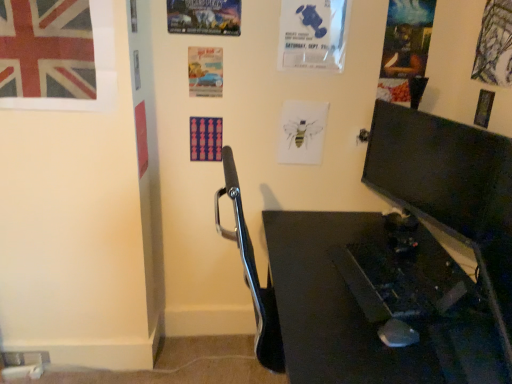
What do you see at coordinates (495, 45) in the screenshot? I see `metallic silver poster at upper right, acting as the 6th poster page starting from the left` at bounding box center [495, 45].

This screenshot has height=384, width=512. Find the location of `matte paper poster at center, the 1th poster page when ordered from left to right`. matte paper poster at center, the 1th poster page when ordered from left to right is located at coordinates (205, 71).

Identify the location of watercolor bee at center, which is the third poster page in left-to-right order. [x=302, y=132].

The width and height of the screenshot is (512, 384). Describe the element at coordinates (442, 172) in the screenshot. I see `matte black monitor at right` at that location.

Find the location of a particular element. This screenshot has height=384, width=512. metallic poster at upper center, positioned as the 5th poster page in right-to-left order is located at coordinates pos(204,17).

From the image's perspective, is matte black monitor at right on top of blue paper poster at upper center, which is the 4th poster page from left to right?

No, from the image's perspective, matte black monitor at right is not on top of blue paper poster at upper center, which is the 4th poster page from left to right.

Is matte black monitor at right not close to blue paper poster at upper center, positioned as the third poster page in right-to-left order?

No, there isn't a large distance between matte black monitor at right and blue paper poster at upper center, positioned as the third poster page in right-to-left order.

Is matte black monitor at right further to the viewer compared to blue paper poster at upper center, positioned as the third poster page in right-to-left order?

No, it is in front of blue paper poster at upper center, positioned as the third poster page in right-to-left order.

Which of these two, matte black monitor at right or blue paper poster at upper center, which is the 4th poster page from left to right, is thinner?

blue paper poster at upper center, which is the 4th poster page from left to right, is thinner.

Which is nearer, (295, 41) or (213, 94)?

Point (295, 41) appears to be closer to the viewer than point (213, 94).

How many degrees apart are the facing directions of blue paper poster at upper center, which is the 4th poster page from left to right, and matte paper poster at center, the 1th poster page when ordered from left to right?

The angle between the facing direction of blue paper poster at upper center, which is the 4th poster page from left to right, and the facing direction of matte paper poster at center, the 1th poster page when ordered from left to right, is 1.68 degrees.

Is blue paper poster at upper center, which is the 4th poster page from left to right, further to camera compared to matte paper poster at center, the 1th poster page when ordered from left to right?

No, it is in front of matte paper poster at center, the 1th poster page when ordered from left to right.

Based on their sizes in the image, would you say blue paper poster at upper center, which is the 4th poster page from left to right, is bigger or smaller than matte paper poster at center, the 1th poster page when ordered from left to right?

In the image, blue paper poster at upper center, which is the 4th poster page from left to right, appears to be larger than matte paper poster at center, the 1th poster page when ordered from left to right.

Considering the sizes of objects union jack fabric poster at upper left and matte paper poster at center, the 1th poster page when ordered from left to right, in the image provided, who is thinner, union jack fabric poster at upper left or matte paper poster at center, the 1th poster page when ordered from left to right,?

With smaller width is matte paper poster at center, the 1th poster page when ordered from left to right.

Considering the positions of point (4, 6) and point (192, 83), is point (4, 6) closer or farther from the camera than point (192, 83)?

Clearly, point (4, 6) is closer to the camera than point (192, 83).

Consider the image. From the image's perspective, is union jack fabric poster at upper left above matte paper poster at center, the sixth poster page viewed from the right?

Yes, from the image's perspective, union jack fabric poster at upper left is over matte paper poster at center, the sixth poster page viewed from the right.

Does union jack fabric poster at upper left have a greater height compared to matte paper poster at center, the sixth poster page viewed from the right?

Yes, union jack fabric poster at upper left is taller than matte paper poster at center, the sixth poster page viewed from the right.

Does matte black monitor at right touch matte paper poster at center, the 1th poster page when ordered from left to right?

No.

Which is in front, matte black monitor at right or matte paper poster at center, the 1th poster page when ordered from left to right?

matte black monitor at right is closer to the camera.

From the picture: Is matte paper poster at center, the sixth poster page viewed from the right, a part of matte black monitor at right?

No, matte paper poster at center, the sixth poster page viewed from the right, is not inside matte black monitor at right.

Is matte black monitor at right facing away from matte paper poster at center, the 1th poster page when ordered from left to right?

No, matte black monitor at right is not facing away from matte paper poster at center, the 1th poster page when ordered from left to right.

Based on the photo, is metallic silver poster at upper right, acting as the 6th poster page starting from the left, completely or partially outside of metallic poster at upper center, the second poster page positioned from the left?

Absolutely, metallic silver poster at upper right, acting as the 6th poster page starting from the left, is external to metallic poster at upper center, the second poster page positioned from the left.

From a real-world perspective, is metallic silver poster at upper right, the first poster page in the right-to-left sequence, physically above metallic poster at upper center, the second poster page positioned from the left?

No, from a real-world perspective, metallic silver poster at upper right, the first poster page in the right-to-left sequence, is not on top of metallic poster at upper center, the second poster page positioned from the left.

Between metallic silver poster at upper right, the first poster page in the right-to-left sequence, and metallic poster at upper center, the second poster page positioned from the left, which one appears on the left side from the viewer's perspective?

Positioned to the left is metallic poster at upper center, the second poster page positioned from the left.

Is the depth of metallic silver poster at upper right, acting as the 6th poster page starting from the left, greater than that of metallic poster at upper center, the second poster page positioned from the left?

No.

From the image's perspective, which object appears higher, metallic silver poster at upper right, the first poster page in the right-to-left sequence, or matte paper poster at center, the 1th poster page when ordered from left to right?

metallic silver poster at upper right, the first poster page in the right-to-left sequence, from the image's perspective.

Which of these two, metallic silver poster at upper right, acting as the 6th poster page starting from the left, or matte paper poster at center, the sixth poster page viewed from the right, is thinner?

matte paper poster at center, the sixth poster page viewed from the right, is thinner.

Considering the points (485, 50) and (202, 58), which point is behind, point (485, 50) or point (202, 58)?

The point (202, 58) is more distant.

Is metallic silver poster at upper right, acting as the 6th poster page starting from the left, completely or partially outside of matte paper poster at center, the sixth poster page viewed from the right?

Yes, metallic silver poster at upper right, acting as the 6th poster page starting from the left, is located beyond the bounds of matte paper poster at center, the sixth poster page viewed from the right.

Consider the image. From the image's perspective, which one is positioned lower, watercolor bee at center, which is the third poster page in left-to-right order, or metallic silver poster at upper right, the first poster page in the right-to-left sequence?

From the image's view, watercolor bee at center, which is the third poster page in left-to-right order, is below.

From the metallic silver poster at upper right, the first poster page in the right-to-left sequence, count 5th poster pages backward and point to it. Please provide its 2D coordinates.

[(302, 132)]

Which point is more distant from viewer, (298, 148) or (489, 56)?

The point (298, 148) is farther from the camera.

Is there a large distance between watercolor bee at center, which is the third poster page in left-to-right order, and metallic silver poster at upper right, the first poster page in the right-to-left sequence?

No.

Locate an element on the screen. Image resolution: width=512 pixels, height=384 pixels. the 1st poster page to the left of the matte black monitor at right, counting from the anchor's position is located at coordinates (313, 34).

At what (x,y) coordinates should I click in order to perform the action: click on poster page that is the 3rd one when counting upward from the matte paper poster at center, the 1th poster page when ordered from left to right (from the image's perspective). Please return your answer as a coordinate pair (x, y). Looking at the image, I should click on (313, 34).

Based on their spatial positions, is metallic silver poster at upper right, the first poster page in the right-to-left sequence, or blue paper poster at upper center, positioned as the third poster page in right-to-left order, closer to black glossy desk at lower right?

Among the two, metallic silver poster at upper right, the first poster page in the right-to-left sequence, is located nearer to black glossy desk at lower right.

Considering their positions, is metallic poster at upper center, the second poster page positioned from the left, positioned closer to watercolor bee at center, the fourth poster page positioned from the right, than blue paper poster at upper center, positioned as the third poster page in right-to-left order?

blue paper poster at upper center, positioned as the third poster page in right-to-left order, is positioned closer to the anchor watercolor bee at center, the fourth poster page positioned from the right.

From the image, which object appears to be farther from watercolor bee at center, which is the third poster page in left-to-right order, oil painting portrait at upper right, which is the second poster page from right to left, or matte black monitor at right?

matte black monitor at right lies further to watercolor bee at center, which is the third poster page in left-to-right order, than the other object.

Which object lies further to the anchor point blue paper poster at upper center, positioned as the third poster page in right-to-left order, metallic poster at upper center, positioned as the 5th poster page in right-to-left order, or metallic silver poster at upper right, acting as the 6th poster page starting from the left?

Based on the image, metallic silver poster at upper right, acting as the 6th poster page starting from the left, appears to be further to blue paper poster at upper center, positioned as the third poster page in right-to-left order.

Looking at the image, which one is located closer to matte black monitor at right, oil painting portrait at upper right, the fifth poster page positioned from the left, or blue paper poster at upper center, positioned as the third poster page in right-to-left order?

oil painting portrait at upper right, the fifth poster page positioned from the left, lies closer to matte black monitor at right than the other object.

When comparing their distances from blue paper poster at upper center, positioned as the third poster page in right-to-left order, does metallic silver poster at upper right, acting as the 6th poster page starting from the left, or black glossy desk at lower right seem further?

black glossy desk at lower right.

Looking at the image, which one is located further to watercolor bee at center, the fourth poster page positioned from the right, metallic poster at upper center, positioned as the 5th poster page in right-to-left order, or black glossy desk at lower right?

A: black glossy desk at lower right.

When comparing their distances from black glossy desk at lower right, does watercolor bee at center, which is the third poster page in left-to-right order, or blue paper poster at upper center, which is the 4th poster page from left to right, seem closer?

watercolor bee at center, which is the third poster page in left-to-right order, is closer to black glossy desk at lower right.

This screenshot has width=512, height=384. In order to click on computer monitor between blue paper poster at upper center, positioned as the third poster page in right-to-left order, and black glossy desk at lower right vertically in this screenshot , I will do `click(442, 172)`.

This screenshot has height=384, width=512. Find the location of `poster page between union jack fabric poster at upper left and metallic poster at upper center, the second poster page positioned from the left, from left to right`. poster page between union jack fabric poster at upper left and metallic poster at upper center, the second poster page positioned from the left, from left to right is located at coordinates 205,71.

The image size is (512, 384). I want to click on computer monitor between metallic poster at upper center, the second poster page positioned from the left, and black glossy desk at lower right from top to bottom, so click(442, 172).

Identify the location of computer monitor between union jack fabric poster at upper left and oil painting portrait at upper right, which is the second poster page from right to left, from left to right. (442, 172).